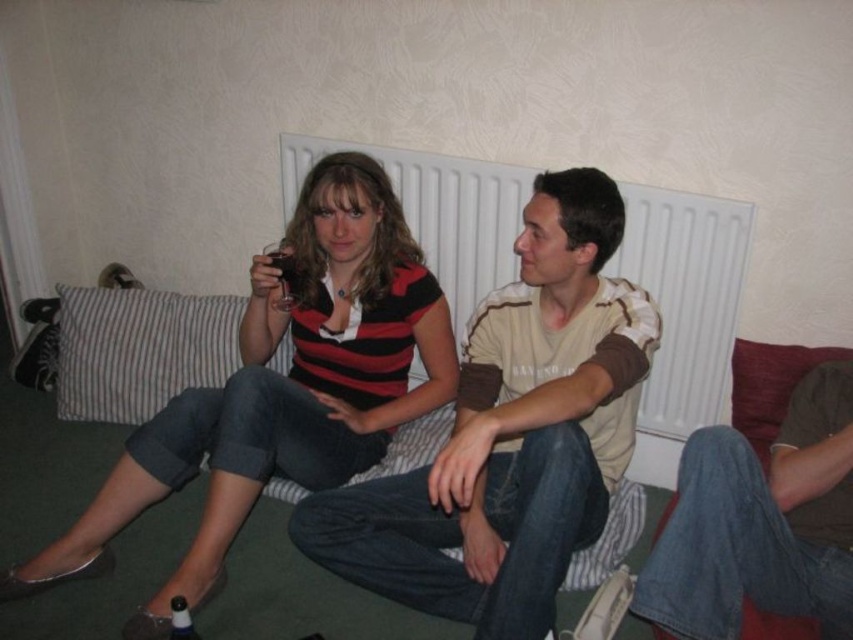
You are a painter standing in the room and want to place a 1.2 meter wide canvas between the white textured radiator at center and the jeans at lower right. Can the canvas fit between them?

The white textured radiator at center might be wider than jeans at lower right, so the distance between them may not be sufficient to accommodate a 1.2 meter wide canvas. You should measure the space first before deciding.